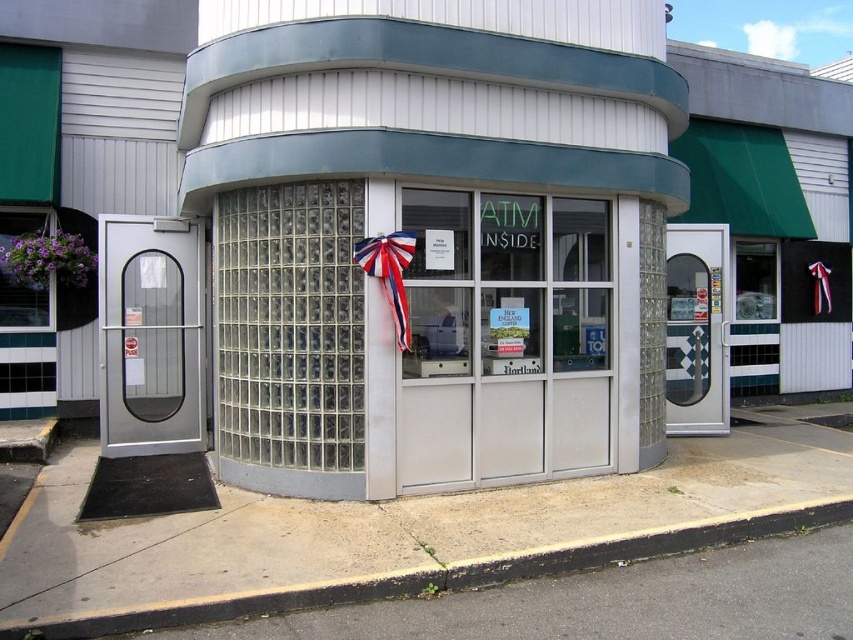
Can you confirm if clear glass atm at center is positioned above red fabric bow at center?

Correct, clear glass atm at center is located above red fabric bow at center.

Can you confirm if clear glass atm at center is smaller than red fabric bow at center?

Incorrect, clear glass atm at center is not smaller in size than red fabric bow at center.

Is point (467, 214) farther from camera compared to point (395, 323)?

Yes, it is behind point (395, 323).

Find the location of a particular element. Image resolution: width=853 pixels, height=640 pixels. clear glass atm at center is located at coordinates (434, 236).